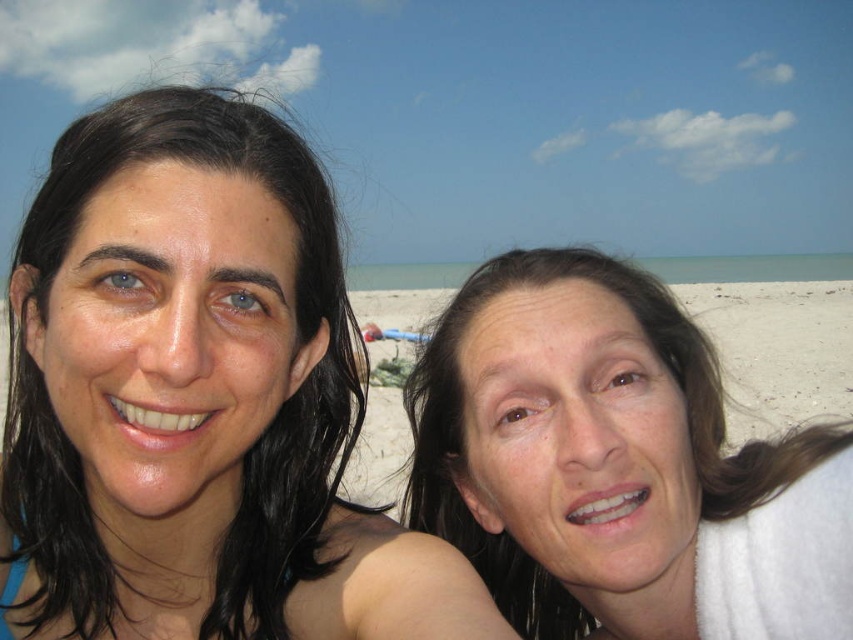
Question: Which point is closer to the camera?

Choices:
 (A) (57, 221)
 (B) (846, 509)

Answer: (A)

Question: Does matte black hair at left have a larger size compared to smooth skin face at right?

Choices:
 (A) no
 (B) yes

Answer: (B)

Question: Which object appears farthest from the camera in this image?

Choices:
 (A) smooth skin face at right
 (B) matte black hair at left

Answer: (A)

Question: Does matte black hair at left have a larger size compared to smooth skin face at right?

Choices:
 (A) yes
 (B) no

Answer: (A)

Question: Does matte black hair at left have a greater width compared to smooth skin face at right?

Choices:
 (A) yes
 (B) no

Answer: (B)